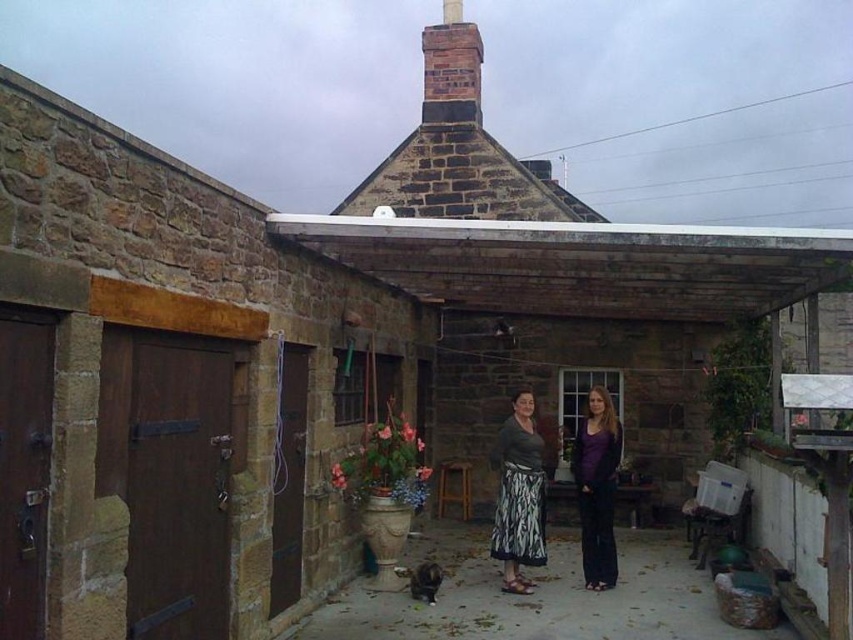
Question: Is matte gray sweater at center to the right of brick chimney at center from the viewer's perspective?

Choices:
 (A) yes
 (B) no

Answer: (A)

Question: Which point appears farthest from the camera in this image?

Choices:
 (A) (413, 637)
 (B) (506, 579)
 (C) (469, 44)

Answer: (C)

Question: Which of these objects is positioned closest to the matte green skirt at center?

Choices:
 (A) brown stone alley at center
 (B) matte gray sweater at center

Answer: (B)

Question: Is matte gray sweater at center wider than matte green skirt at center?

Choices:
 (A) yes
 (B) no

Answer: (B)

Question: Which point is farther from the camera taking this photo?

Choices:
 (A) (466, 36)
 (B) (439, 589)
 (C) (590, 532)

Answer: (A)

Question: Considering the relative positions of brown stone alley at center and matte gray sweater at center in the image provided, where is brown stone alley at center located with respect to matte gray sweater at center?

Choices:
 (A) left
 (B) right

Answer: (A)